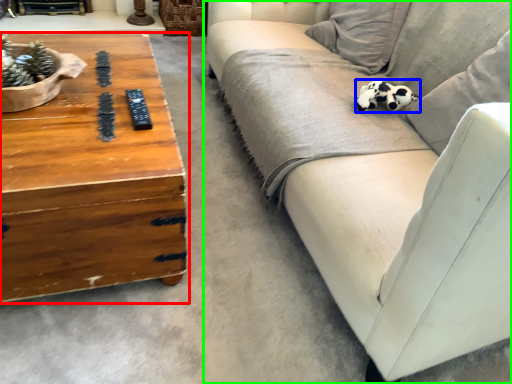
Question: Based on their relative distances, which object is nearer to coffee table (highlighted by a red box)? Choose from animal (highlighted by a blue box) and studio couch (highlighted by a green box).

Choices:
 (A) animal
 (B) studio couch

Answer: (B)